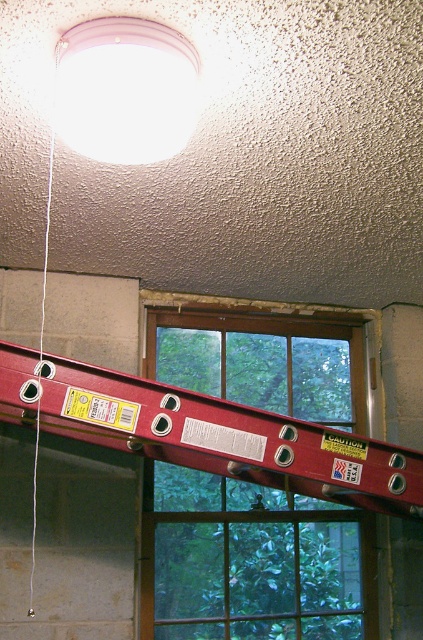
You are a painter holding a 1.2 meter long paintbrush. You want to reach the white matte light fixture at upper center to clean it. Can you safely clean it without extending the ladder?

The white matte light fixture at upper center is 1.02 meters away from the viewer. Since the paintbrush is 1.2 meters long, it is long enough to reach the light fixture without needing to extend the ladder.

Looking at this image, you are a painter who needs to reach the clear glass window at center and the white matte light fixture at upper center. Which object is taller so you can decide which requires a taller ladder?

The clear glass window at center has a greater height compared to the white matte light fixture at upper center, so you should use a taller ladder to reach the clear glass window at center.